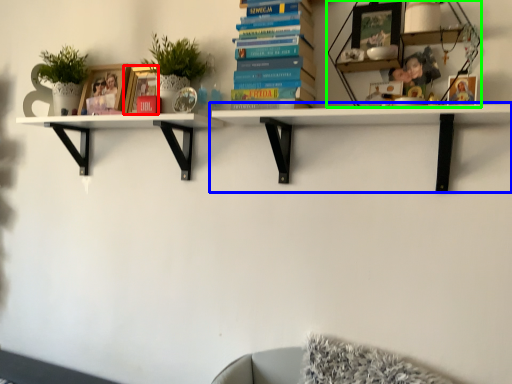
Question: Which is farther away from picture frame (highlighted by a red box)? shelf (highlighted by a blue box) or shelf (highlighted by a green box)?

Choices:
 (A) shelf
 (B) shelf

Answer: (B)